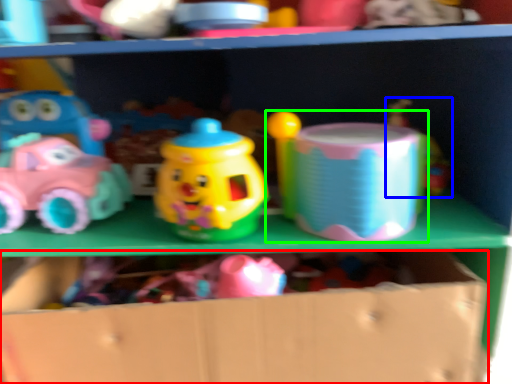
Question: Which object is positioned farthest from cardboard box (highlighted by a red box)? Select from toy (highlighted by a blue box) and toy (highlighted by a green box).

Choices:
 (A) toy
 (B) toy

Answer: (A)